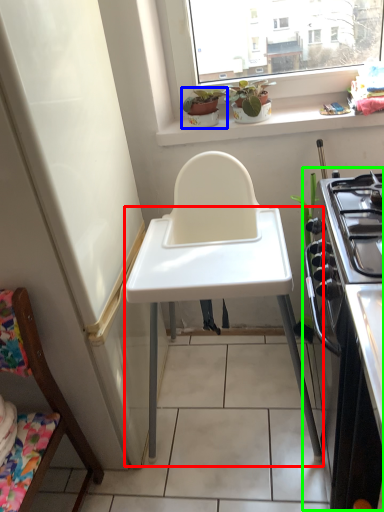
Question: Based on their relative distances, which object is nearer to table (highlighted by a red box)? Choose from houseplant (highlighted by a blue box) and appliance (highlighted by a green box).

Choices:
 (A) houseplant
 (B) appliance

Answer: (B)